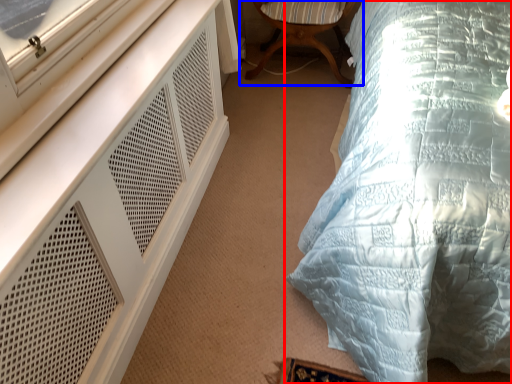
Question: Which object appears farthest to the camera in this image, bed (highlighted by a red box) or chair (highlighted by a blue box)?

Choices:
 (A) bed
 (B) chair

Answer: (B)